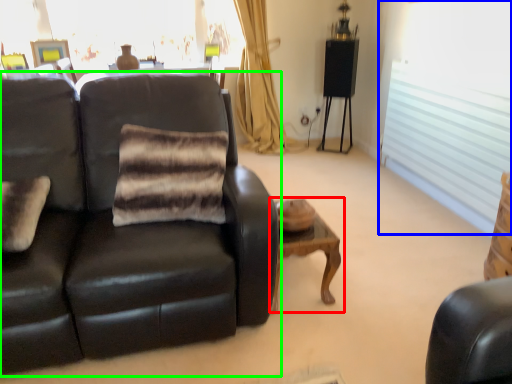
Question: Considering the real-world distances, which object is farthest from table (highlighted by a red box)? window (highlighted by a blue box) or studio couch (highlighted by a green box)?

Choices:
 (A) window
 (B) studio couch

Answer: (A)